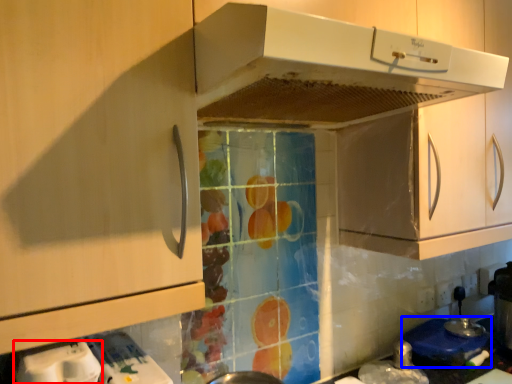
Question: Which object is further to the camera taking this photo, appliance (highlighted by a red box) or appliance (highlighted by a blue box)?

Choices:
 (A) appliance
 (B) appliance

Answer: (B)